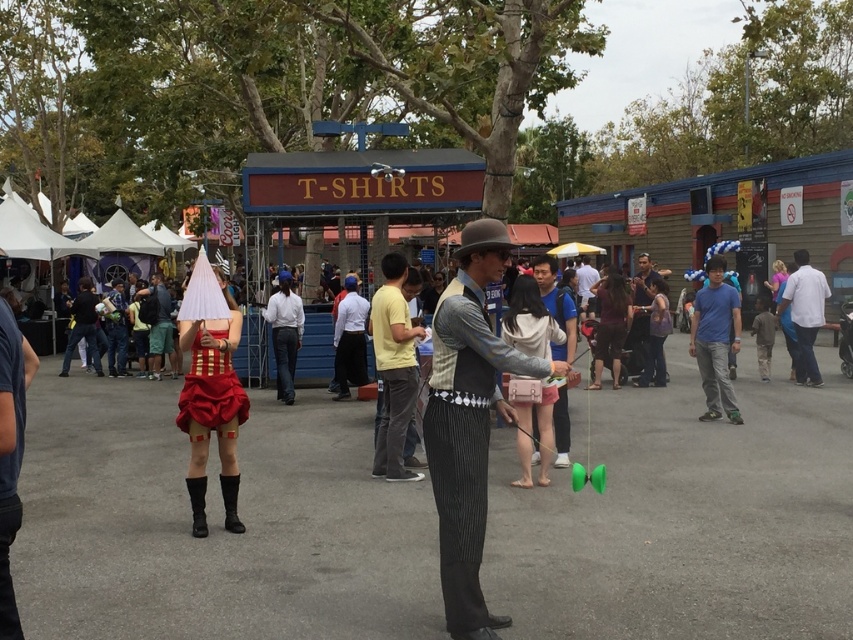
Question: Does yellow cotton shirt at center have a greater width compared to blue cotton shirt at center?

Choices:
 (A) no
 (B) yes

Answer: (A)

Question: Can you confirm if white shirt at right is thinner than light brown leather jacket at center?

Choices:
 (A) no
 (B) yes

Answer: (A)

Question: From the image, what is the correct spatial relationship of silver metallic vest at center in relation to blue cotton shirt at center?

Choices:
 (A) right
 (B) left

Answer: (B)

Question: Which point appears closest to the camera in this image?

Choices:
 (A) (709, 397)
 (B) (410, 380)
 (C) (560, 317)

Answer: (B)

Question: Which of the following is the closest to the observer?

Choices:
 (A) (815, 324)
 (B) (645, 280)
 (C) (395, 269)

Answer: (C)

Question: Which of the following is the closest to the observer?

Choices:
 (A) (642, 284)
 (B) (456, 438)
 (C) (560, 291)
 (D) (405, 480)

Answer: (B)